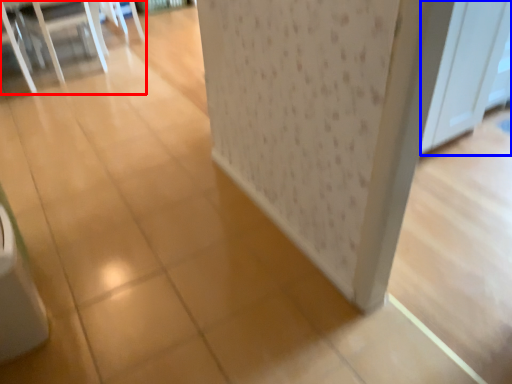
Question: Which object is further to the camera taking this photo, furniture (highlighted by a red box) or screen door (highlighted by a blue box)?

Choices:
 (A) furniture
 (B) screen door

Answer: (A)